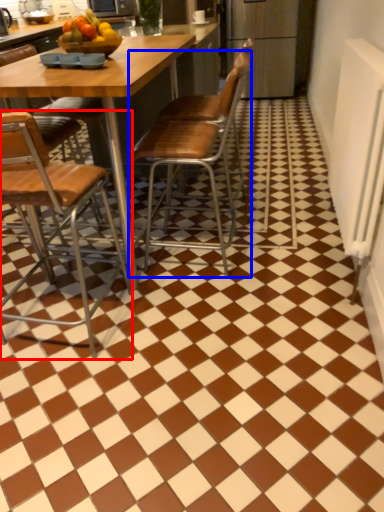
Question: Which of the following is the closest to the observer, chair (highlighted by a red box) or chair (highlighted by a blue box)?

Choices:
 (A) chair
 (B) chair

Answer: (A)